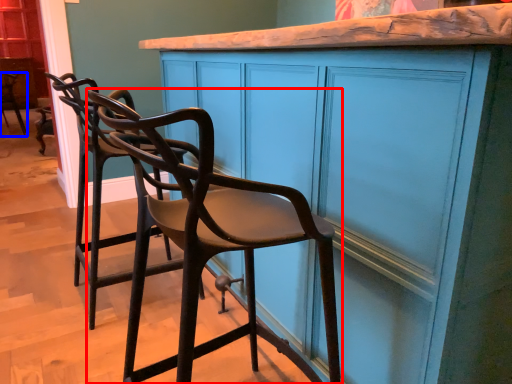
Question: Which of the following is the closest to the observer, chair (highlighted by a red box) or chair (highlighted by a blue box)?

Choices:
 (A) chair
 (B) chair

Answer: (A)